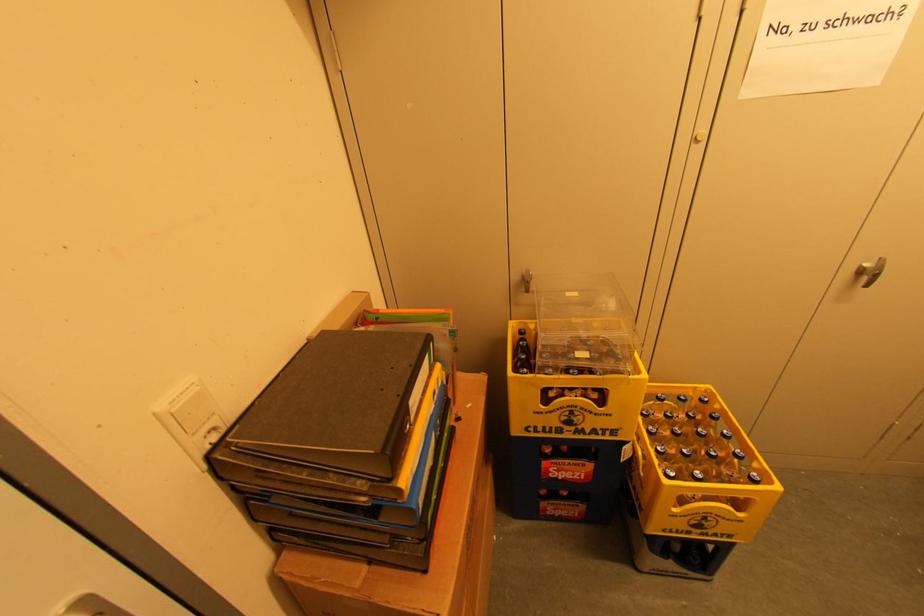
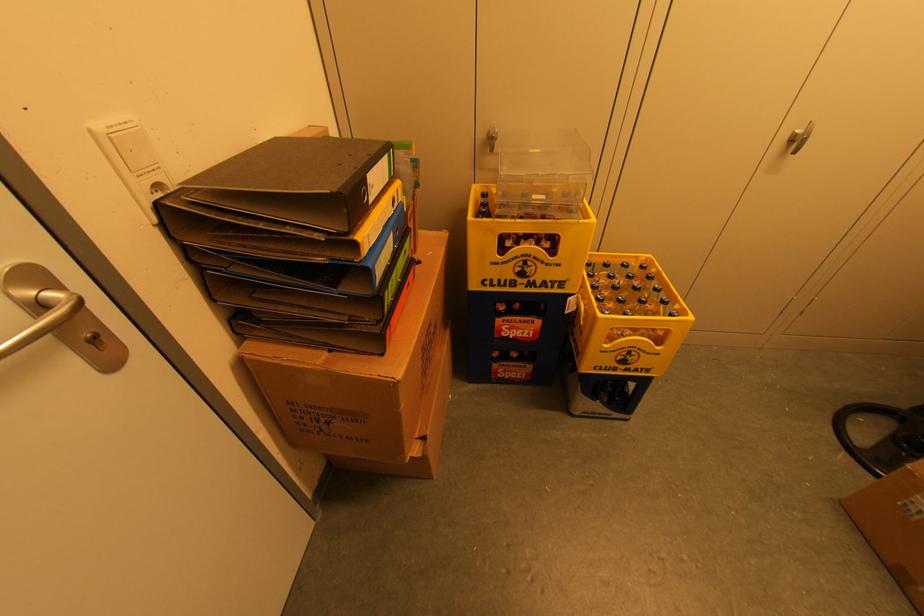
The point at the highlighted location is marked in the first image. Where is the corresponding point in the second image?

(501, 322)